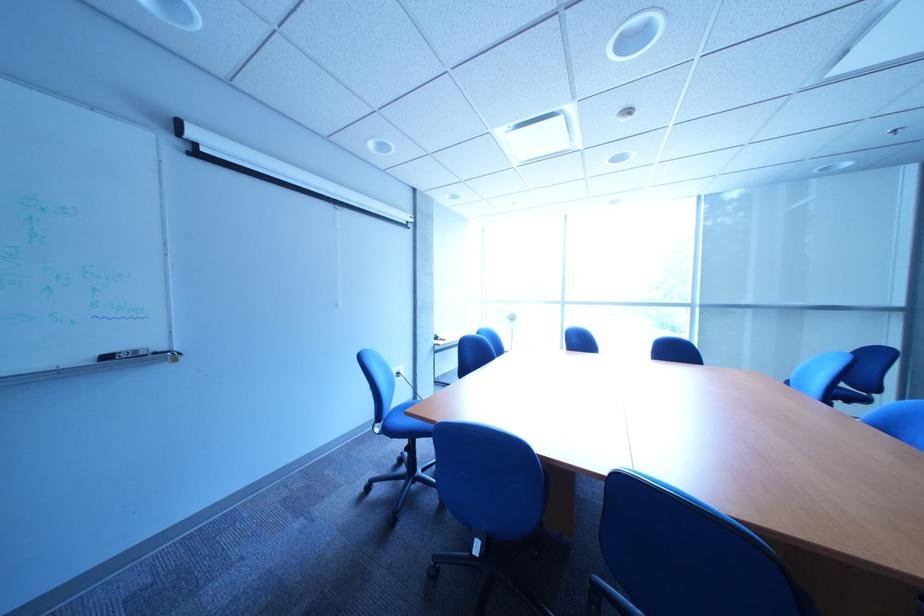
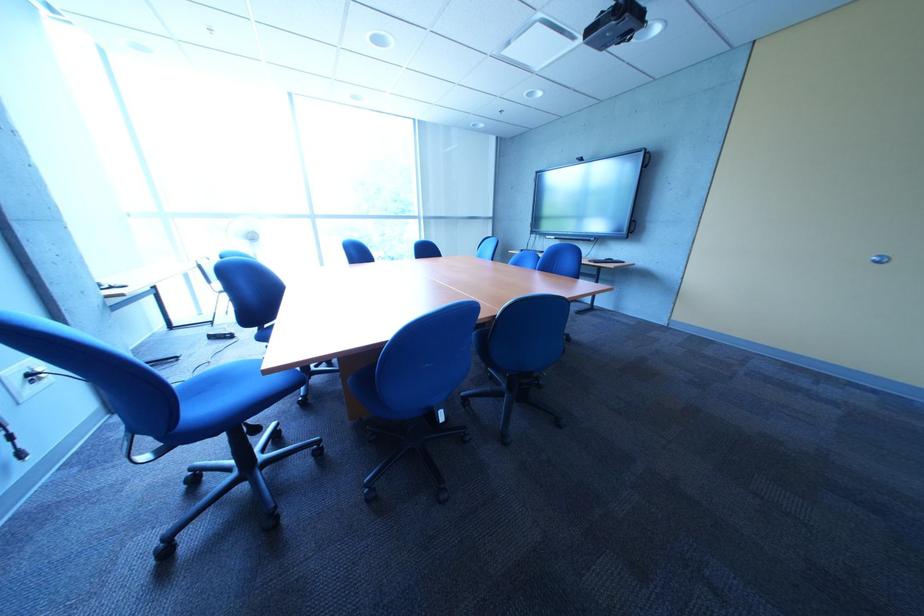
Consider the image. The first image is from the beginning of the video and the second image is from the end. How did the camera likely rotate when shooting the video?

The rotation direction of the camera is right-down.